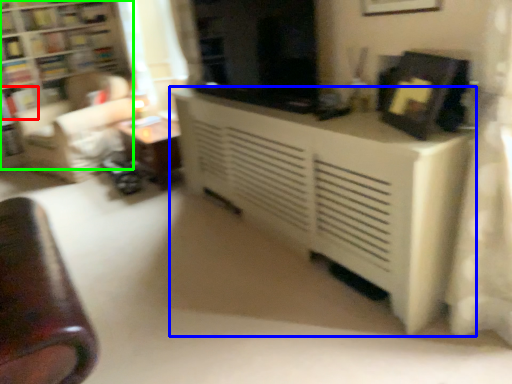
Question: Considering the real-world distances, which object is closest to book (highlighted by a red box)? table (highlighted by a blue box) or bookcase (highlighted by a green box).

Choices:
 (A) table
 (B) bookcase

Answer: (B)